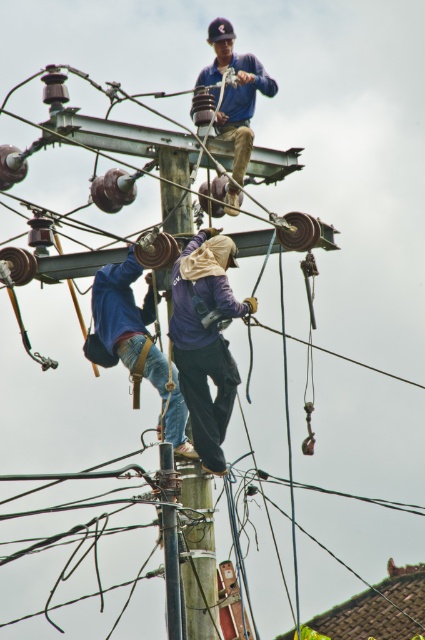
You are a safety inspector reviewing the image of the workers on the utility pole. You need to determine if the blue denim shirt at upper center and the wooden telegraph pole at center are visible in the image. Which object is larger in the photo?

The blue denim shirt at upper center is larger in size than the wooden telegraph pole at center, so the blue denim shirt at upper center appears larger in the photo.

You are planning to place a safety net for the purple fabric construction worker at center. Based on their current position, where should the safety net be positioned relative to the utility pole?

The safety net should be positioned at point (206, 339) to align with the purple fabric construction worker at center.

You are a safety inspector reviewing the image of the workers on the utility pole. You need to ensure that the blue denim jeans at center and the blue denim shirt at upper center are visible for compliance checks. Which of these items is larger in size?

The blue denim jeans at center is larger in size than the blue denim shirt at upper center.